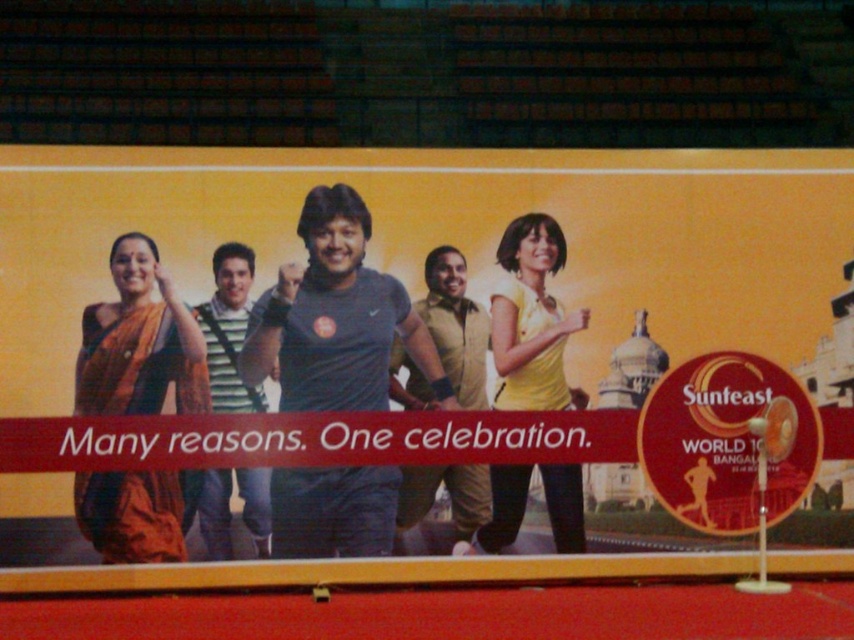
Who is taller, matte gray t-shirt at center or matte orange saree at left?

With more height is matte gray t-shirt at center.

Describe the element at coordinates (458, 244) in the screenshot. The width and height of the screenshot is (854, 640). I see `matte gray t-shirt at center` at that location.

Locate an element on the screen. matte gray t-shirt at center is located at coordinates (458, 244).

You are a GUI agent. You are given a task and a screenshot of the screen. Output one action in this format:
    pyautogui.click(x=<x>, y=<y>)
    Task: Click on the matte gray t-shirt at center
    The width and height of the screenshot is (854, 640).
    Given the screenshot: What is the action you would take?
    pyautogui.click(x=458, y=244)

Who is more distant from viewer, (x=180, y=509) or (x=231, y=474)?

The point (x=231, y=474) is behind.

Who is more forward, (85,339) or (227,557)?

Point (85,339)

Locate an element on the screen. The height and width of the screenshot is (640, 854). matte orange saree at left is located at coordinates (138, 340).

Who is positioned more to the right, matte orange saree at left or yellow matte dress at center?

yellow matte dress at center

Does matte orange saree at left appear under yellow matte dress at center?

Indeed, matte orange saree at left is positioned under yellow matte dress at center.

Locate an element on the screen. The image size is (854, 640). matte orange saree at left is located at coordinates (138, 340).